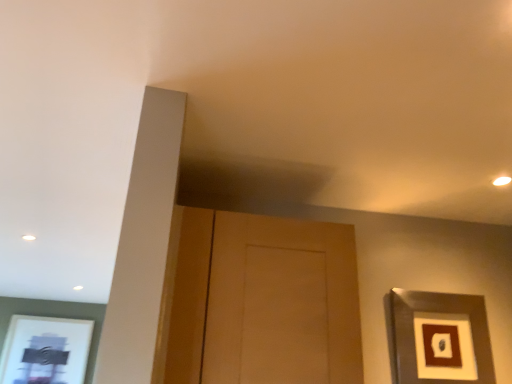
Question: Considering the positions of wooden door at center and metallic silver picture frame at upper right in the image, is wooden door at center wider or thinner than metallic silver picture frame at upper right?

Choices:
 (A) thin
 (B) wide

Answer: (B)

Question: Is wooden door at center bigger or smaller than metallic silver picture frame at upper right?

Choices:
 (A) big
 (B) small

Answer: (A)

Question: From their relative heights in the image, would you say wooden door at center is taller or shorter than metallic silver picture frame at upper right?

Choices:
 (A) tall
 (B) short

Answer: (A)

Question: Considering the positions of metallic silver picture frame at upper right and wooden door at center in the image, is metallic silver picture frame at upper right taller or shorter than wooden door at center?

Choices:
 (A) short
 (B) tall

Answer: (A)

Question: From the image's perspective, relative to wooden door at center, is metallic silver picture frame at upper right above or below?

Choices:
 (A) below
 (B) above

Answer: (A)

Question: Looking at the image, does metallic silver picture frame at upper right seem bigger or smaller compared to wooden door at center?

Choices:
 (A) small
 (B) big

Answer: (A)

Question: Is metallic silver picture frame at upper right inside the boundaries of wooden door at center, or outside?

Choices:
 (A) outside
 (B) inside

Answer: (A)